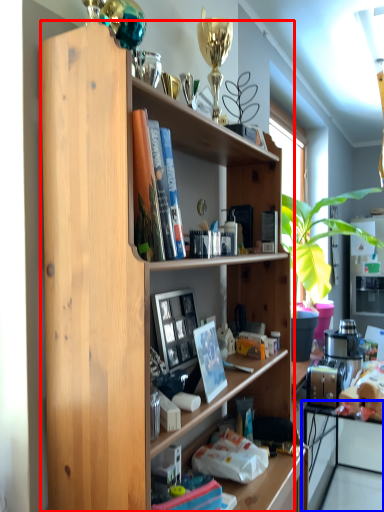
Question: Which object is further to the camera taking this photo, shelf (highlighted by a red box) or computer (highlighted by a blue box)?

Choices:
 (A) shelf
 (B) computer

Answer: (B)